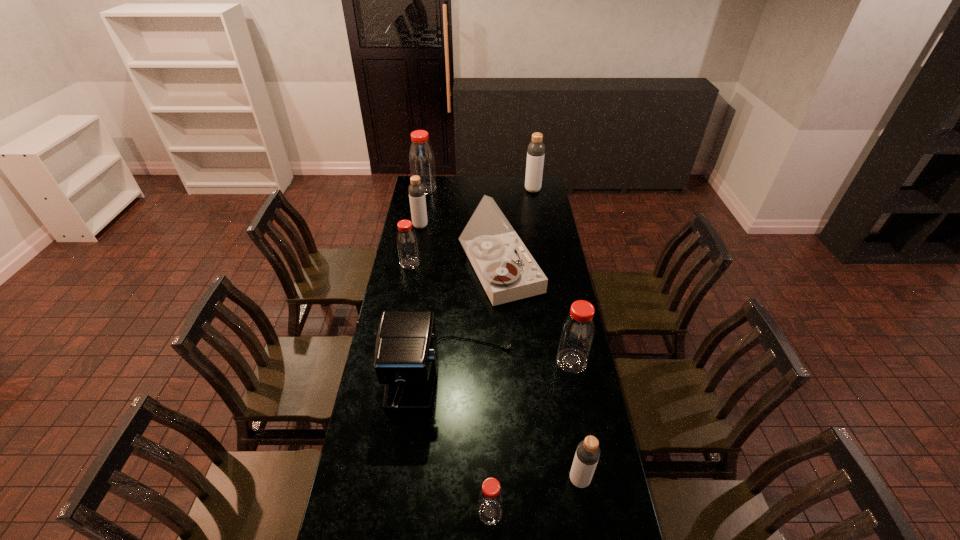
The width and height of the screenshot is (960, 540). Identify the location of the farthest red bottle. (421, 157).

Locate an element on the screen. This screenshot has height=540, width=960. the farthest gray bottle is located at coordinates (536, 149).

At what (x,y) coordinates should I click in order to perform the action: click on white record player. Please return your answer as a coordinate pair (x, y). The image size is (960, 540). Looking at the image, I should click on (507, 271).

Image resolution: width=960 pixels, height=540 pixels. What are the coordinates of `the leftmost gray bottle` in the screenshot? It's located at (416, 189).

Identify the location of the second nearest gray bottle. (416, 189).

Locate an element on the screen. the fifth farthest bottle is located at coordinates (576, 338).

Locate an element on the screen. This screenshot has height=540, width=960. the third farthest red bottle is located at coordinates (576, 338).

Image resolution: width=960 pixels, height=540 pixels. In order to click on coffee maker in this screenshot , I will do `click(406, 353)`.

Locate an element on the screen. This screenshot has width=960, height=540. the third biggest red bottle is located at coordinates (407, 245).

Find the location of `the fourth farthest bottle`. the fourth farthest bottle is located at coordinates (407, 245).